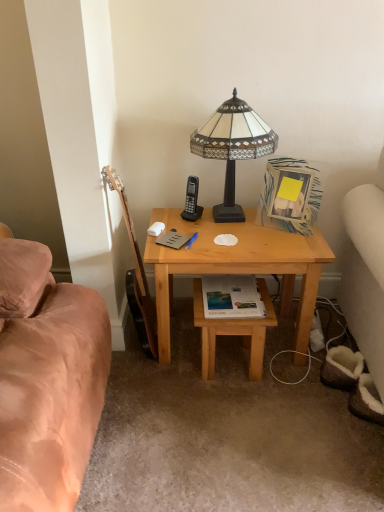
The height and width of the screenshot is (512, 384). I want to click on empty space that is in between light brown wooden stool at lower center and brown wood guitar at left, so click(x=180, y=358).